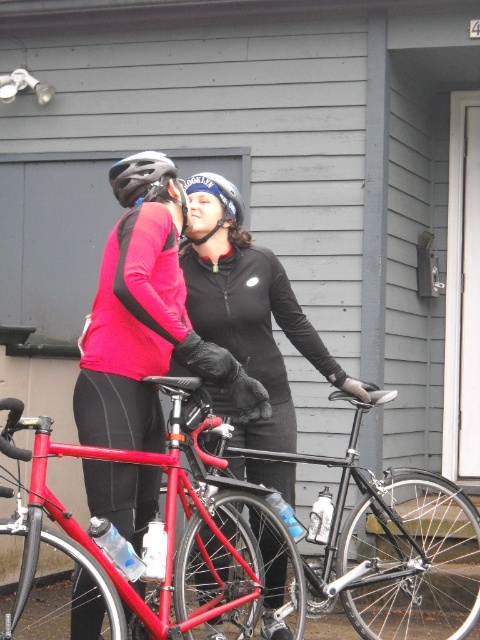
Question: In this image, where is shiny red frame bicycle at center located relative to matte black helmet at upper center?

Choices:
 (A) left
 (B) right

Answer: (B)

Question: Can you confirm if matte black jacket at center is bigger than black matte jacket at center?

Choices:
 (A) no
 (B) yes

Answer: (A)

Question: Which of the following is the farthest from the observer?

Choices:
 (A) black matte jacket at center
 (B) shiny red frame bicycle at center

Answer: (A)

Question: Does shiny red frame bicycle at center appear over matte black helmet at upper center?

Choices:
 (A) no
 (B) yes

Answer: (A)

Question: Estimate the real-world distances between objects in this image. Which object is farther from the matte black helmet at upper center?

Choices:
 (A) shiny red frame bicycle at center
 (B) matte black jacket at center

Answer: (A)

Question: Which of the following is the farthest from the observer?

Choices:
 (A) shiny red frame bicycle at center
 (B) black matte jacket at center

Answer: (B)